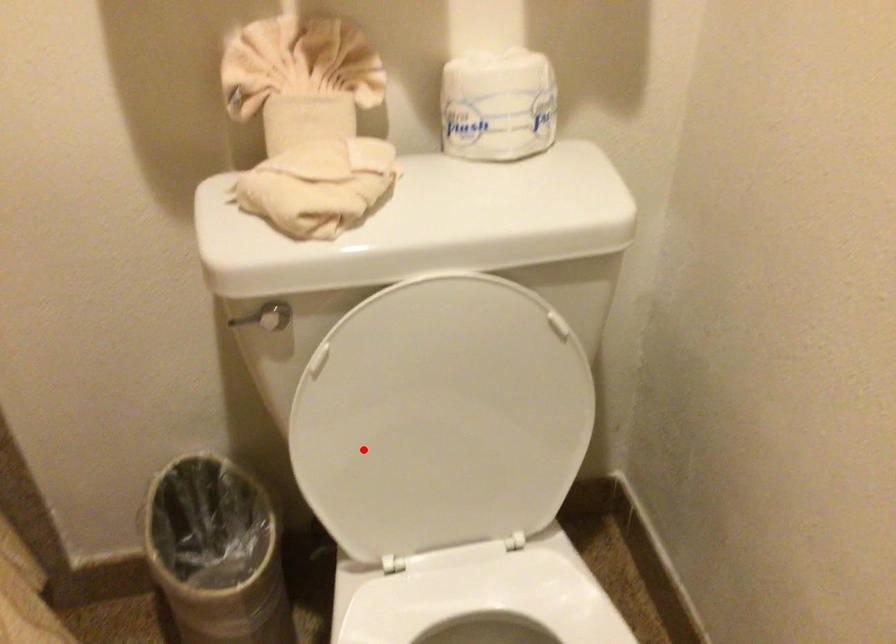
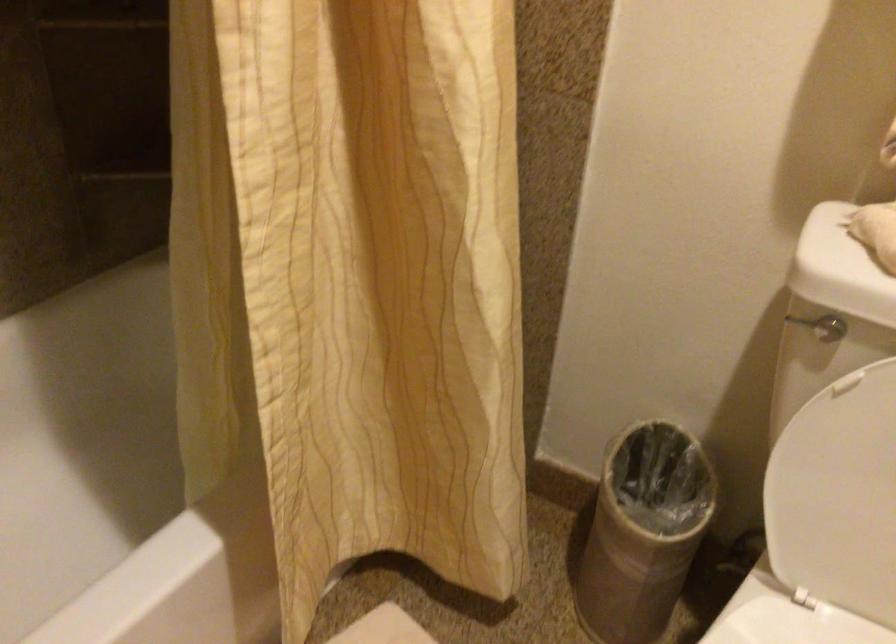
Locate, in the second image, the point that corresponds to the highlighted location in the first image.

(834, 480)